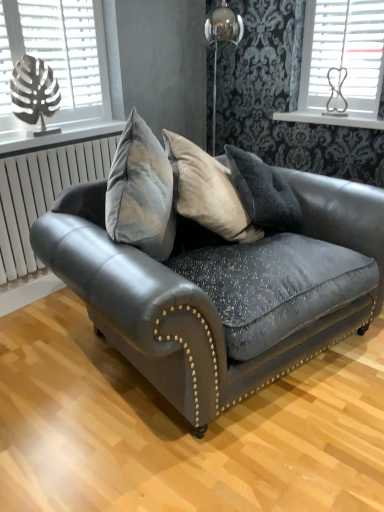
Question: Is velvet dark gray couch at center bigger or smaller than white metallic radiator at left?

Choices:
 (A) big
 (B) small

Answer: (A)

Question: Based on their positions, is velvet dark gray couch at center located to the left or right of white metallic radiator at left?

Choices:
 (A) left
 (B) right

Answer: (B)

Question: Considering the real-world distances, which object is farthest from the white wooden shelf at upper right?

Choices:
 (A) white plastic blinds at upper right, the 2th window positioned from the left
 (B) velvet dark gray couch at center
 (C) metallic leaf at left, the second window positioned from the right
 (D) white metallic radiator at left

Answer: (D)

Question: Which is farther from the white plastic blinds at upper right, the 2th window positioned from the left?

Choices:
 (A) white metallic radiator at left
 (B) velvet dark gray couch at center
 (C) white wooden shelf at upper right
 (D) metallic leaf at left, the second window positioned from the right

Answer: (A)